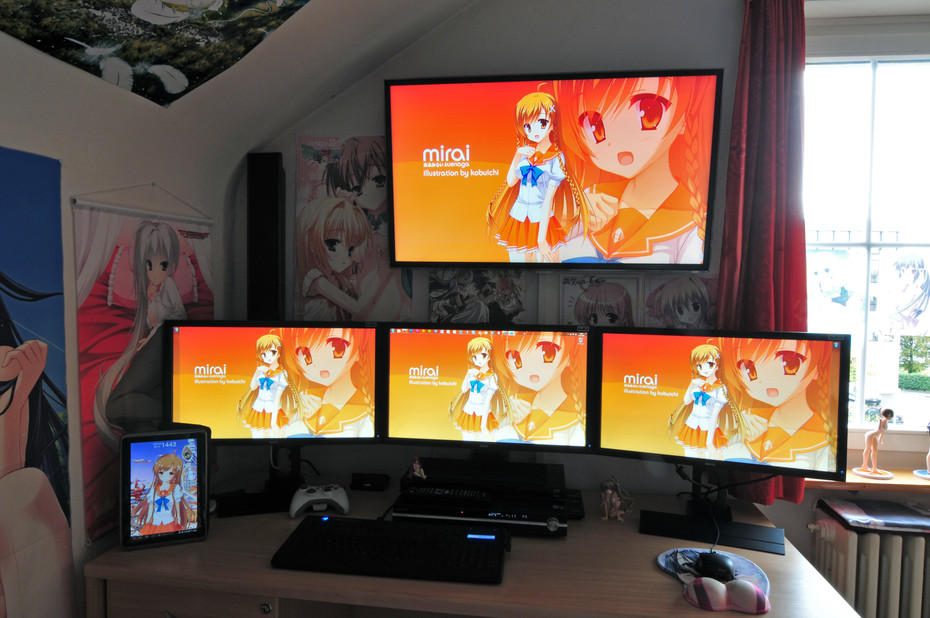
Find the location of `screen 2`. screen 2 is located at coordinates (303, 363).